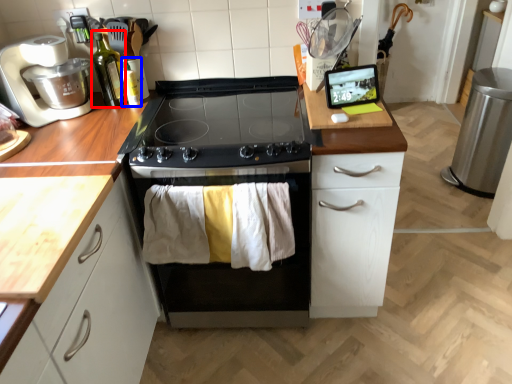
Question: Which of the following is the closest to the observer, bottle (highlighted by a red box) or bottle (highlighted by a blue box)?

Choices:
 (A) bottle
 (B) bottle

Answer: (A)